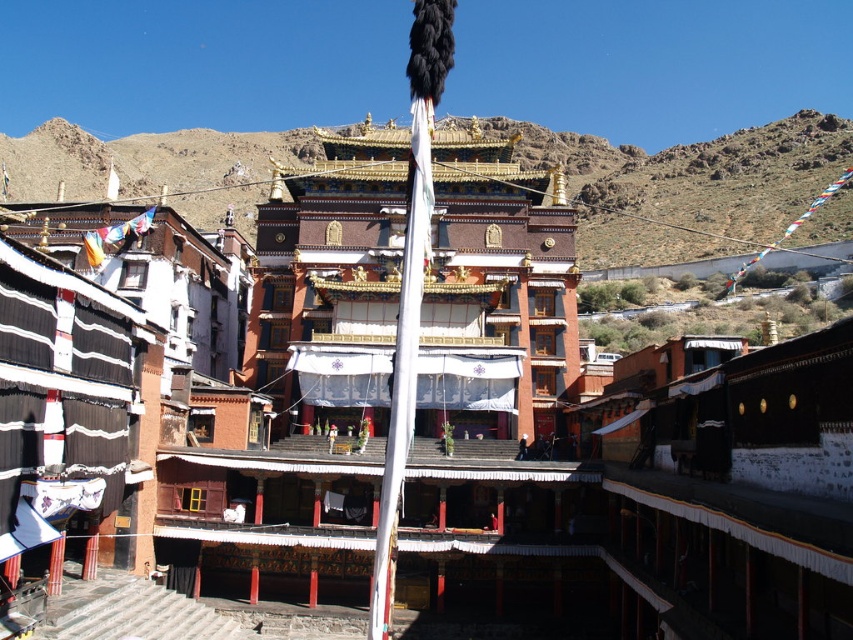
In the scene shown: You are a photographer planning to capture the entire Tibetan monastery complex in one shot. Given that the brown rocky mountain at upper center and the white fabric flag pole at center are both in the frame, which object would appear bigger in your photo?

The brown rocky mountain at upper center would appear bigger in the photo because it has a larger size compared to the white fabric flag pole at center.

You are standing in the courtyard of the monastery and want to take a photo of the white fabric flag pole at center. To include the brown rocky mountain at upper center in the frame, should you pan your camera to the left or right?

To include the brown rocky mountain at upper center in the photo of the white fabric flag pole at center, you should pan your camera to the left because the brown rocky mountain at upper center is located to the left of the white fabric flag pole at center.

You are standing in the courtyard of the Tibetan monastery and want to take a photo of the brown rocky mountain at upper center. Based on its coordinates, where should you position yourself to ensure the mountain is centered in your camera frame?

The brown rocky mountain at upper center is located at point coordinates, so you should position yourself in the courtyard facing the upper central direction to center it in your camera frame.